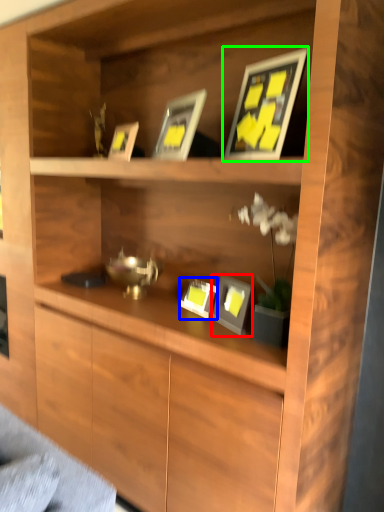
Question: Which object is positioned closest to picture frame (highlighted by a red box)? Select from picture frame (highlighted by a blue box) and picture frame (highlighted by a green box).

Choices:
 (A) picture frame
 (B) picture frame

Answer: (A)